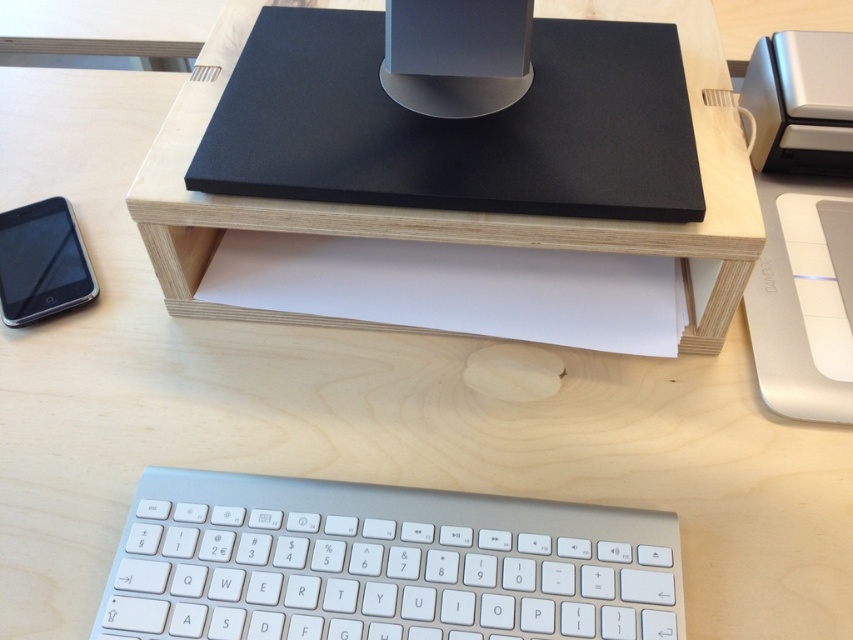
Question: Is white plastic keyboard at center to the left of matte black speaker at center from the viewer's perspective?

Choices:
 (A) no
 (B) yes

Answer: (B)

Question: Which object is closer to the camera taking this photo?

Choices:
 (A) white plastic keyboard at center
 (B) matte black speaker at center
 (C) matte black smartphone at lower left

Answer: (A)

Question: Is white plastic keyboard at center to the right of matte black smartphone at lower left from the viewer's perspective?

Choices:
 (A) no
 (B) yes

Answer: (B)

Question: Which point appears farthest from the camera in this image?

Choices:
 (A) (579, 544)
 (B) (456, 26)
 (C) (51, 230)

Answer: (C)

Question: Does matte black speaker at center have a smaller size compared to matte black smartphone at lower left?

Choices:
 (A) no
 (B) yes

Answer: (B)

Question: Which object appears farthest from the camera in this image?

Choices:
 (A) matte black smartphone at lower left
 (B) matte black speaker at center

Answer: (A)